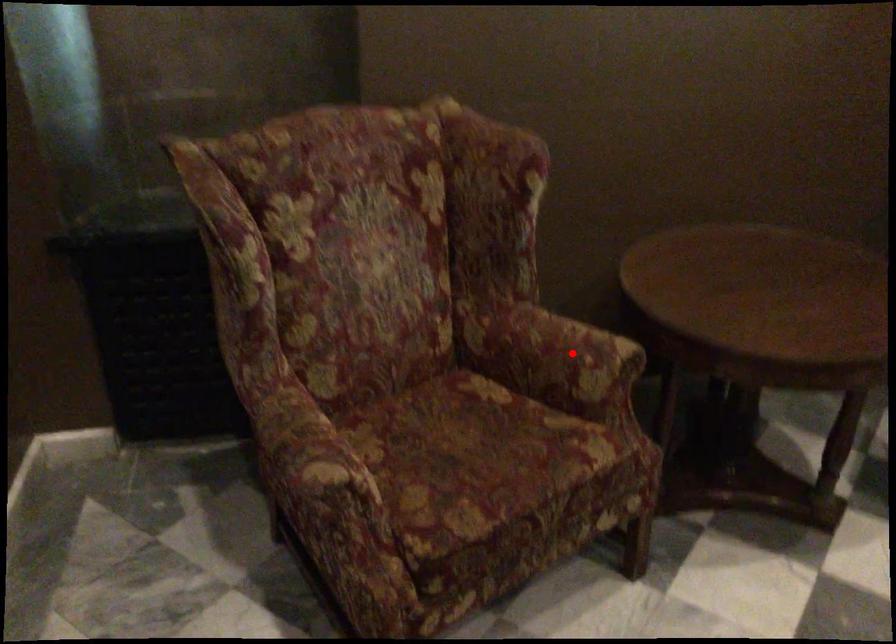
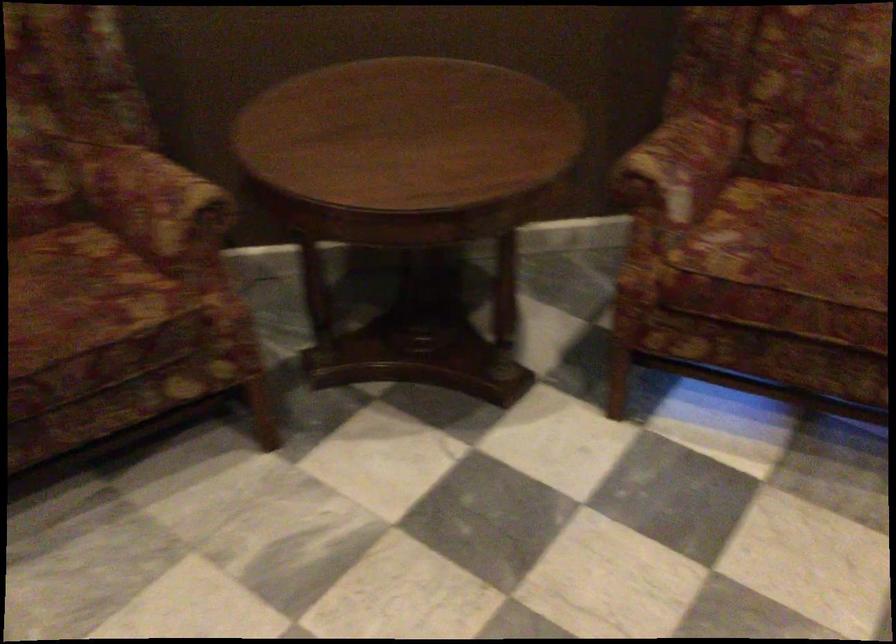
Locate, in the second image, the point that corresponds to the highlighted location in the first image.

(156, 204)